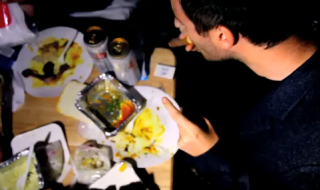
The width and height of the screenshot is (320, 190). Find the location of `dishes`. dishes is located at coordinates (141, 90), (83, 61).